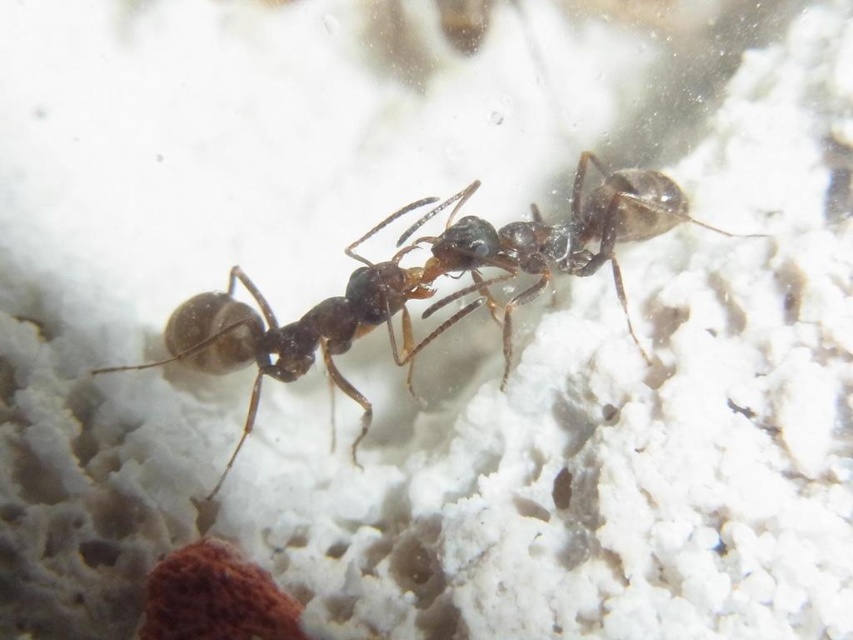
Who is more distant from viewer, (486, 262) or (506, 326)?

The point (486, 262) is behind.

Does brown glossy ant at center have a lesser width compared to shiny black ant at center?

Incorrect, brown glossy ant at center's width is not less than shiny black ant at center's.

This screenshot has height=640, width=853. Identify the location of brown glossy ant at center. (328, 314).